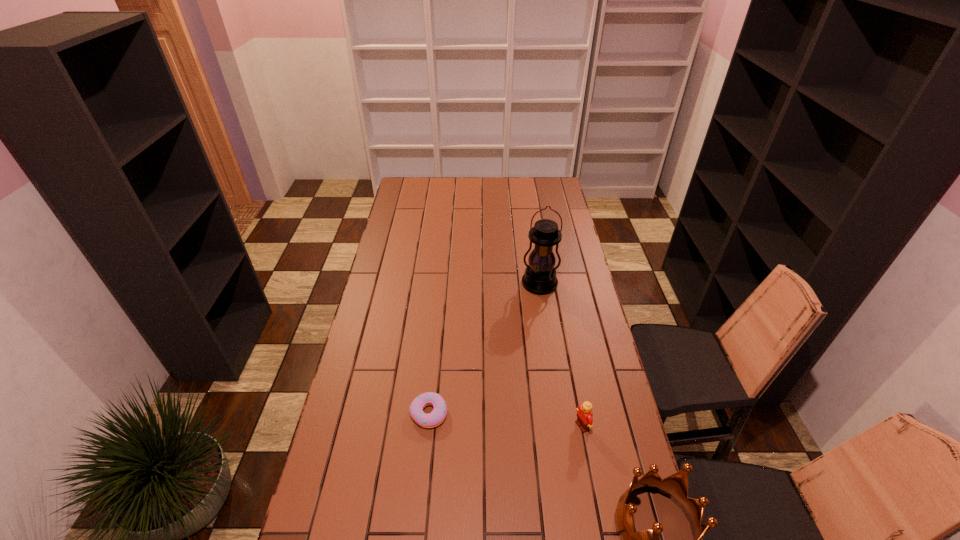
The width and height of the screenshot is (960, 540). I want to click on free space between the doughnut and the third tallest object, so click(505, 420).

Where is `vacant area that lies between the third tallest object and the tallest object`? vacant area that lies between the third tallest object and the tallest object is located at coordinates (561, 355).

You are a GUI agent. You are given a task and a screenshot of the screen. Output one action in this format:
    pyautogui.click(x=<x>, y=<y>)
    Task: Click on the vacant space that's between the farthest object and the leftmost object
    This screenshot has width=960, height=540.
    Given the screenshot: What is the action you would take?
    pyautogui.click(x=484, y=348)

Identify the location of free space between the Lego and the doughnut. (505, 420).

Find the location of `empty space between the shortest object and the Lego`. empty space between the shortest object and the Lego is located at coordinates (505, 420).

Where is `free space between the farthest object and the shortest object`? The width and height of the screenshot is (960, 540). free space between the farthest object and the shortest object is located at coordinates (484, 348).

Locate an element on the screen. Image resolution: width=960 pixels, height=540 pixels. empty location between the doughnut and the Lego is located at coordinates (505, 420).

Locate which object ranks second in proximity to the tallest object. Please provide its 2D coordinates. Your answer should be formatted as a tuple, i.e. [(x, y)], where the tuple contains the x and y coordinates of a point satisfying the conditions above.

[(437, 416)]

Locate an element on the screen. The width and height of the screenshot is (960, 540). object that is the nearest to the lantern is located at coordinates (584, 420).

You are a GUI agent. You are given a task and a screenshot of the screen. Output one action in this format:
    pyautogui.click(x=<x>, y=<y>)
    Task: Click on the vacant region that satisfies the following two spatial constraints: 1. on the front side of the lantern; 2. on the left side of the second shortest object
    
    Given the screenshot: What is the action you would take?
    pyautogui.click(x=562, y=426)